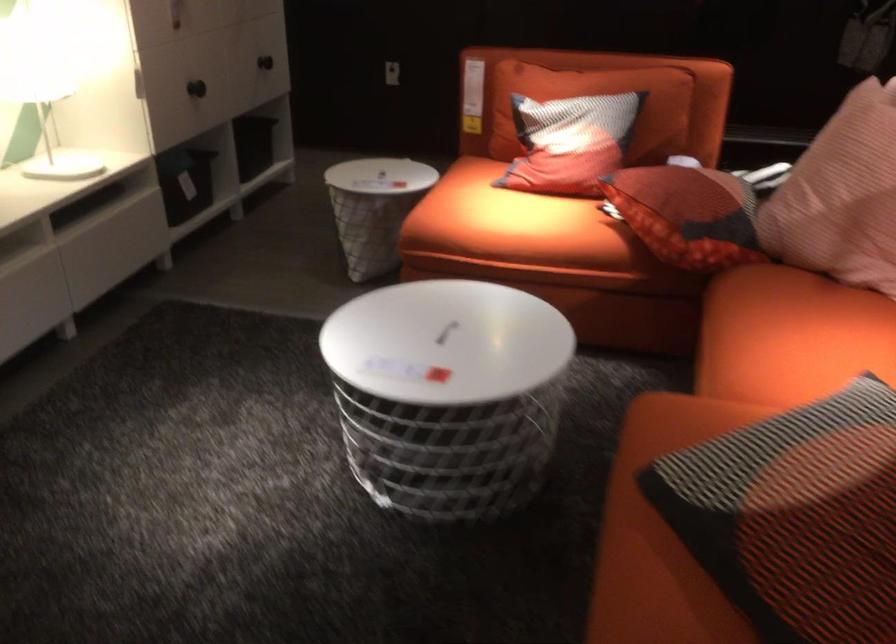
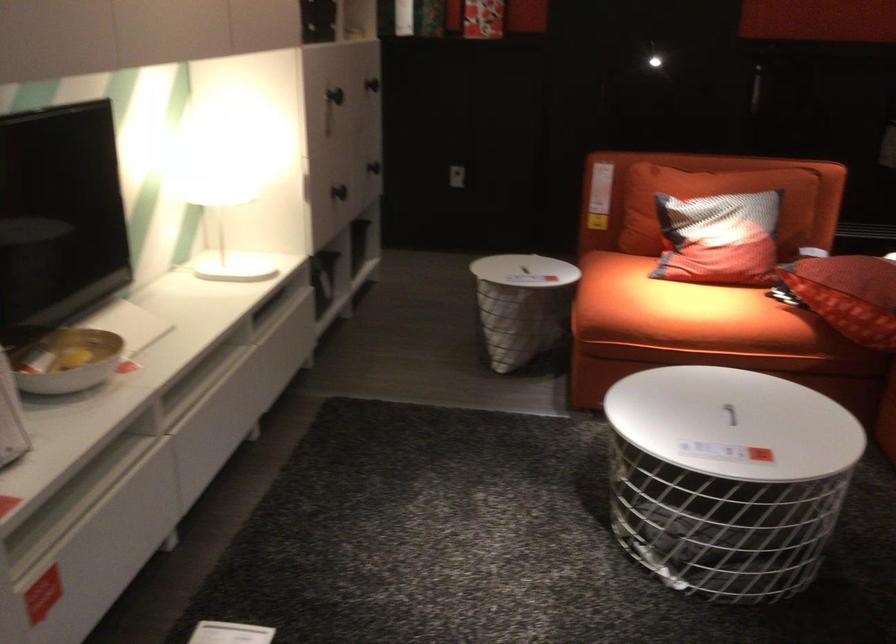
Locate, in the second image, the point that corresponds to point (197, 84) in the first image.

(339, 192)